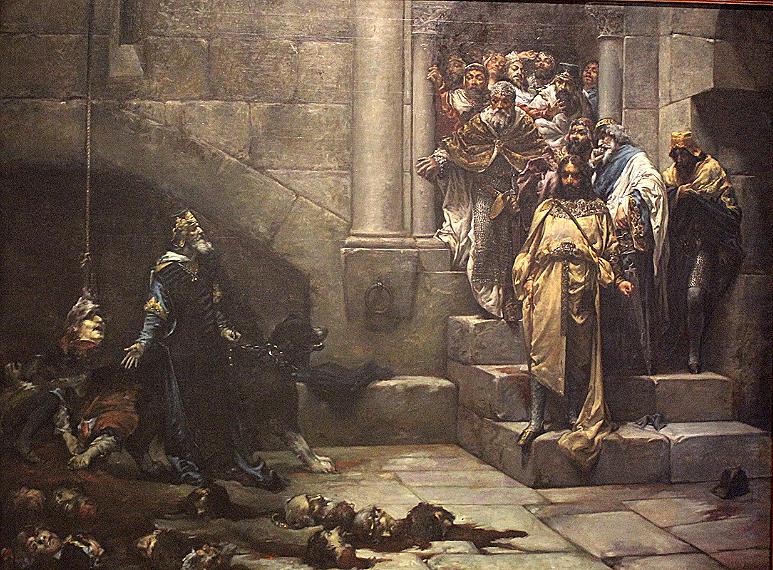
Where is `dungeon wall`? This screenshot has height=570, width=773. dungeon wall is located at coordinates (278, 89), (727, 66).